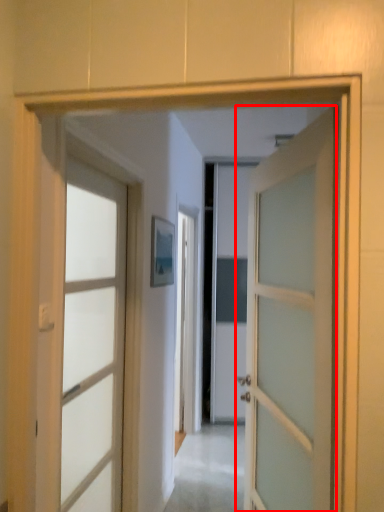
Question: From the image's perspective, what is the correct spatial positioning of door (annotated by the red box) in reference to door?

Choices:
 (A) above
 (B) below

Answer: (A)